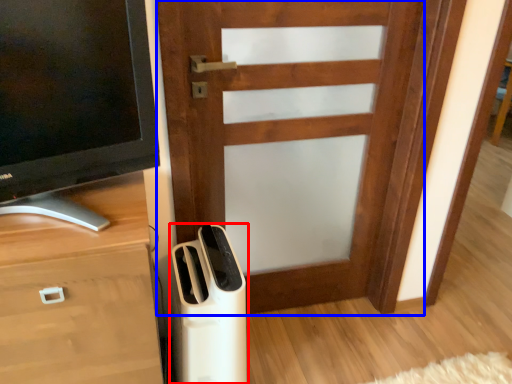
Question: Which object is further to the camera taking this photo, home appliance (highlighted by a red box) or door (highlighted by a blue box)?

Choices:
 (A) home appliance
 (B) door

Answer: (B)